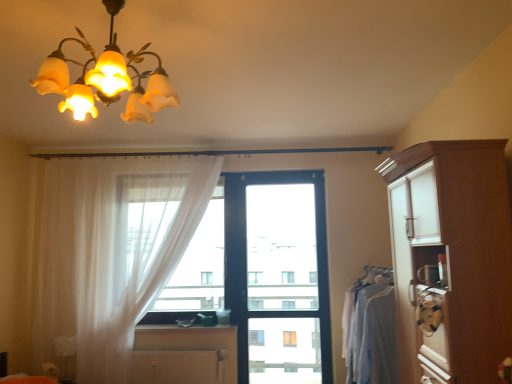
What do you see at coordinates (147, 219) in the screenshot? I see `translucent fabric at center` at bounding box center [147, 219].

This screenshot has height=384, width=512. Describe the element at coordinates (278, 276) in the screenshot. I see `black plastic window at center` at that location.

Where is `black plastic window at center`? This screenshot has width=512, height=384. black plastic window at center is located at coordinates coord(278,276).

The image size is (512, 384). What do you see at coordinates (183, 328) in the screenshot? I see `smooth wooden counter top at center` at bounding box center [183, 328].

Identify the location of matte glass chandelier at upper left. (106, 79).

The image size is (512, 384). What are the coordinates of `white matte cabinet at lower center, the second cabinetry in the top-to-bottom sequence` in the screenshot? It's located at (175, 367).

Considering the relative sizes of black plastic window at center and light gray fabric at right in the image provided, is black plastic window at center smaller than light gray fabric at right?

Yes.

Is black plastic window at center shorter than light gray fabric at right?

No, black plastic window at center is not shorter than light gray fabric at right.

From the image's perspective, who appears lower, black plastic window at center or light gray fabric at right?

light gray fabric at right, from the image's perspective.

Which point is more distant from viewer, (88, 111) or (278, 218)?

Point (278, 218)

Relative to black plastic window at center, is matte glass chandelier at upper left in front or behind?

Clearly, matte glass chandelier at upper left is in front of black plastic window at center.

Is matte glass chandelier at upper left positioned with its back to black plastic window at center?

That's right, matte glass chandelier at upper left is facing away from black plastic window at center.

Where is `lamp on the left of black plastic window at center`? lamp on the left of black plastic window at center is located at coordinates (106, 79).

Could you tell me if brown wood cabinet at right, the 1th cabinetry when ordered from top to bottom, is turned towards white matte cabinet at lower center, acting as the first cabinetry starting from the bottom?

No.

Looking at this image, from the image's perspective, is brown wood cabinet at right, which appears as the 2th cabinetry when viewed from the left, positioned above or below white matte cabinet at lower center, the 1th cabinetry positioned from the left?

brown wood cabinet at right, which appears as the 2th cabinetry when viewed from the left, is situated higher than white matte cabinet at lower center, the 1th cabinetry positioned from the left, in the image.

Where is `window frame lying in front of the translucent fabric at center`? window frame lying in front of the translucent fabric at center is located at coordinates (278, 276).

Is translucent fabric at center inside the boundaries of black plastic window at center, or outside?

translucent fabric at center lies outside black plastic window at center.

Who is more distant, translucent fabric at center or black plastic window at center?

translucent fabric at center is behind.

Between white sheer curtain at center and black plastic window at center, which one has more height?

Standing taller between the two is white sheer curtain at center.

Based on the photo, is white sheer curtain at center bigger than black plastic window at center?

Indeed, white sheer curtain at center has a larger size compared to black plastic window at center.

Is white sheer curtain at center positioned with its back to black plastic window at center?

No, white sheer curtain at center is not facing the opposite direction of black plastic window at center.

Is black plastic window at center smaller than white matte cabinet at lower center, which ranks as the 2th cabinetry in front-to-back order?

No, black plastic window at center is not smaller than white matte cabinet at lower center, which ranks as the 2th cabinetry in front-to-back order.

Would you say black plastic window at center is a long distance from white matte cabinet at lower center, the first cabinetry positioned from the back?

That's not correct — black plastic window at center is a little close to white matte cabinet at lower center, the first cabinetry positioned from the back.

Which is more distant, (271, 334) or (175, 376)?

The point (271, 334) is more distant.

How far apart are black plastic window at center and white matte cabinet at lower center, which ranks as the 2th cabinetry in front-to-back order?

They are 35.26 inches apart.

Is white matte cabinet at lower center, the second cabinetry in the top-to-bottom sequence, facing towards matte glass chandelier at upper left?

No.

Is white matte cabinet at lower center, which ranks as the 2th cabinetry in front-to-back order, positioned in front of matte glass chandelier at upper left?

No, it is not.

Considering the positions of points (166, 356) and (69, 87), is point (166, 356) closer to camera compared to point (69, 87)?

No, it is behind (69, 87).

From a real-world perspective, between white matte cabinet at lower center, acting as the first cabinetry starting from the bottom, and matte glass chandelier at upper left, who is vertically higher?

matte glass chandelier at upper left is physically above.

Locate an element on the screen. clothing below the black plastic window at center (from a real-world perspective) is located at coordinates (372, 335).

The image size is (512, 384). I want to click on window frame behind the matte glass chandelier at upper left, so coord(278,276).

When comparing their distances from light gray fabric at right, does matte glass chandelier at upper left or black plastic window at center seem closer?

Among the two, black plastic window at center is located nearer to light gray fabric at right.

Considering their positions, is matte glass chandelier at upper left positioned further to white matte cabinet at lower center, the second cabinetry in the top-to-bottom sequence, than white sheer curtain at center?

Among the two, matte glass chandelier at upper left is located further to white matte cabinet at lower center, the second cabinetry in the top-to-bottom sequence.

Which object lies nearer to the anchor point black plastic window at center, translucent fabric at center or smooth wooden counter top at center?

translucent fabric at center is closer to black plastic window at center.

From the image, which object appears to be nearer to brown wood cabinet at right, positioned as the first cabinetry in right-to-left order, translucent fabric at center or white sheer curtain at center?

translucent fabric at center.

Considering their positions, is black plastic window at center positioned further to translucent fabric at center than white sheer curtain at center?

Based on the image, white sheer curtain at center appears to be further to translucent fabric at center.

When comparing their distances from translucent fabric at center, does light gray fabric at right or brown wood cabinet at right, placed as the first cabinetry when sorted from front to back, seem closer?

Among the two, light gray fabric at right is located nearer to translucent fabric at center.

Looking at the image, which one is located further to light gray fabric at right, white sheer curtain at center or white matte cabinet at lower center, acting as the second cabinetry starting from the right?

white sheer curtain at center is further to light gray fabric at right.

When comparing their distances from light gray fabric at right, does matte glass chandelier at upper left or white matte cabinet at lower center, which ranks as the 2th cabinetry in front-to-back order, seem further?

Based on the image, matte glass chandelier at upper left appears to be further to light gray fabric at right.

Where is `counter top between matte glass chandelier at upper left and black plastic window at center in the front-back direction`? The height and width of the screenshot is (384, 512). counter top between matte glass chandelier at upper left and black plastic window at center in the front-back direction is located at coordinates (183, 328).

Locate an element on the screen. This screenshot has width=512, height=384. window screen situated between smooth wooden counter top at center and black plastic window at center from left to right is located at coordinates (147, 219).

You are a GUI agent. You are given a task and a screenshot of the screen. Output one action in this format:
    pyautogui.click(x=<x>, y=<y>)
    Task: Click on the window frame between translucent fabric at center and white matte cabinet at lower center, the 1th cabinetry positioned from the left, from top to bottom
    This screenshot has width=512, height=384.
    Given the screenshot: What is the action you would take?
    pyautogui.click(x=278, y=276)

This screenshot has height=384, width=512. In order to click on counter top between white sheer curtain at center and white matte cabinet at lower center, acting as the first cabinetry starting from the bottom, from top to bottom in this screenshot , I will do `click(183, 328)`.